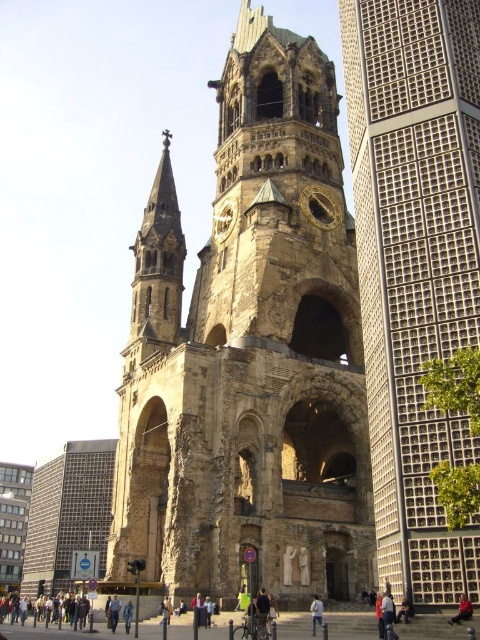
You are standing at the base of the ruined church tower and want to take a photo of the point at coordinates point (x=399, y=120). If your camera has a maximum zoom range of 40 meters, will you be able to capture the point in your photo?

The point at coordinates point (x=399, y=120) is 44.25 meters away from the camera. Since the camera can only zoom up to 40 meters, you won

Based on the photo, you are an architect analyzing the spatial arrangement of the buildings in the image. Which structure, the gray concrete tower at right or the brown stone tower at center, appears closer to the viewer?

The gray concrete tower at right is positioned over the brown stone tower at center, meaning it appears closer to the viewer.

You are an urban planner assessing the visual impact of new construction. The gray concrete tower at right and the gold metallic clock at center are both visible from a proposed park area. Which structure would appear more dominant in the skyline when viewed from the park?

The gray concrete tower at right has a larger size compared to the gold metallic clock at center, so it would appear more dominant in the skyline when viewed from the park.